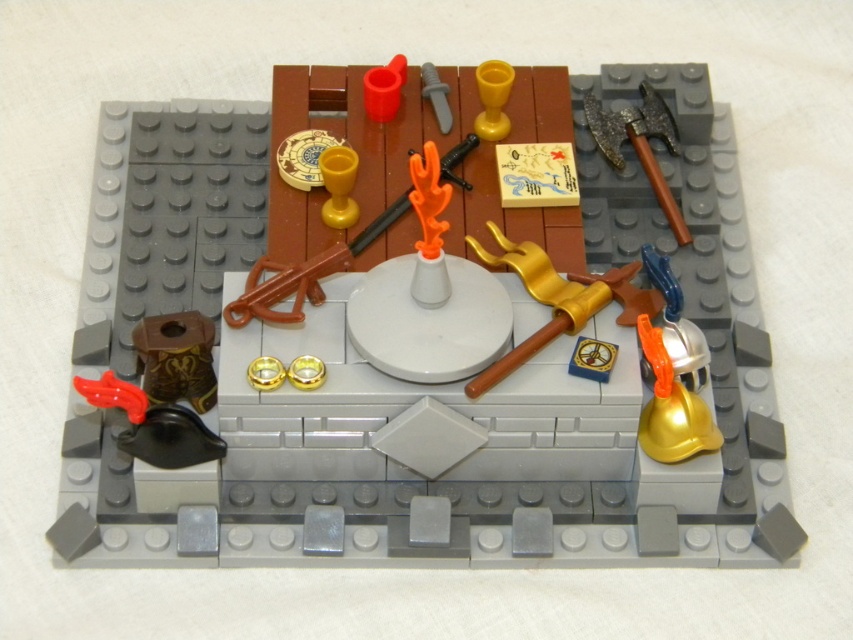
Is smooth brown cup at upper center wider than gold metallic sword at center-right?

Yes, smooth brown cup at upper center is wider than gold metallic sword at center-right.

Which of these two, smooth brown cup at upper center or gold metallic sword at center-right, stands taller?

smooth brown cup at upper center

Is point (250, 428) closer to camera compared to point (529, 241)?

That is True.

This screenshot has width=853, height=640. I want to click on smooth brown cup at upper center, so click(x=387, y=356).

Does smooth brown cup at upper center appear over orange plastic torch at center?

Actually, smooth brown cup at upper center is below orange plastic torch at center.

Is point (315, 68) in front of point (303, 300)?

That is False.

Locate an element on the screen. This screenshot has width=853, height=640. smooth brown cup at upper center is located at coordinates (387, 356).

Does point (630, 369) lie in front of point (608, 131)?

Yes, it is.

Can you confirm if smooth brown cup at upper center is smaller than dark brown wood axe at upper right?

No.

The width and height of the screenshot is (853, 640). I want to click on smooth brown cup at upper center, so click(x=387, y=356).